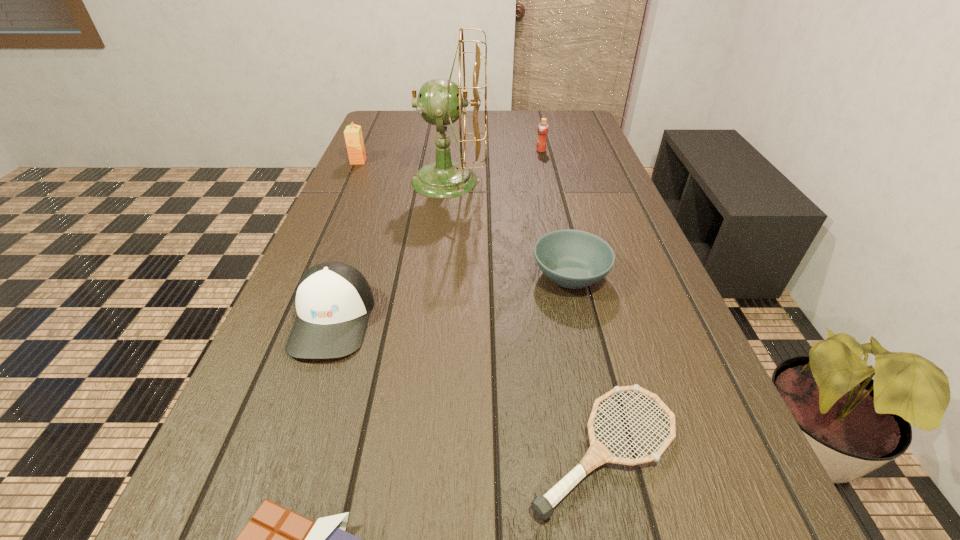
Locate an element on the screen. This screenshot has width=960, height=540. blank space that satisfies the following two spatial constraints: 1. on the back side of the tennis racket; 2. on the left side of the farthest object is located at coordinates (538, 151).

Find the location of a particular element. blank space that satisfies the following two spatial constraints: 1. on the back side of the third shortest object; 2. in front of the tallest object, directing air flow is located at coordinates (548, 181).